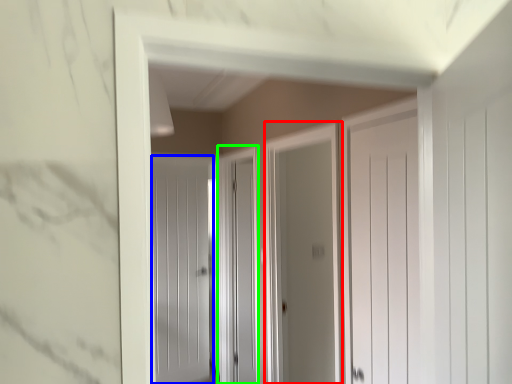
Question: Estimate the real-world distances between objects in this image. Which object is closer to screen door (highlighted by a red box), door (highlighted by a blue box) or screen door (highlighted by a green box)?

Choices:
 (A) door
 (B) screen door

Answer: (B)